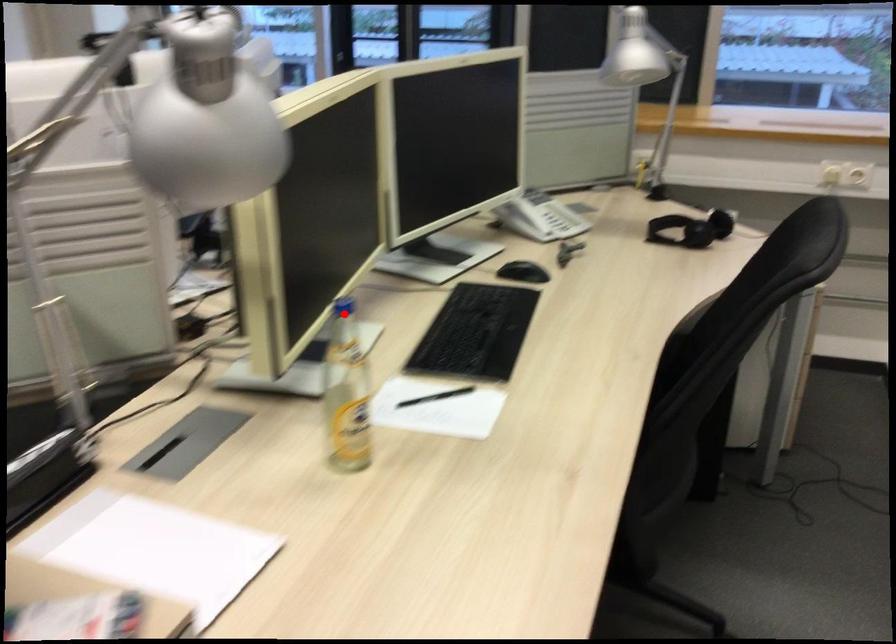
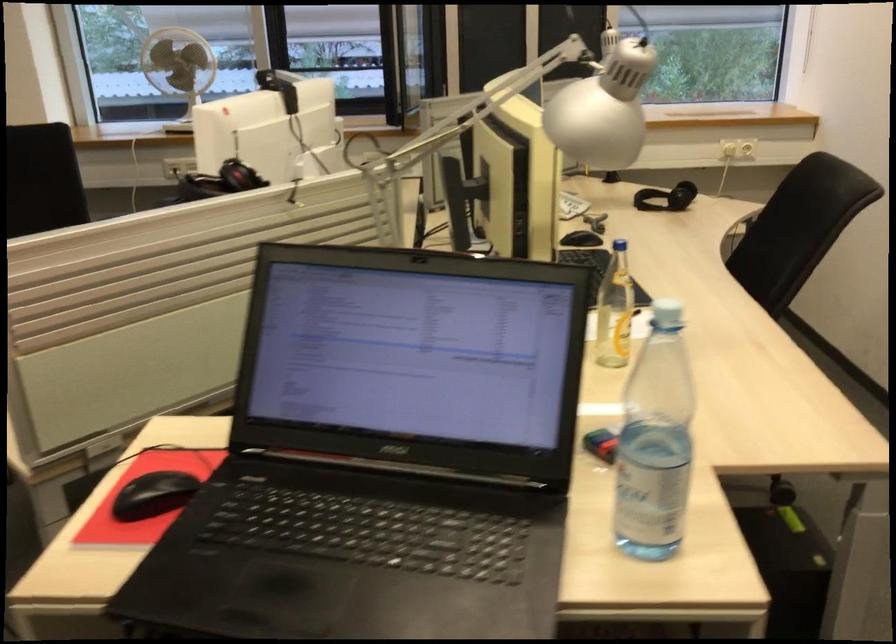
The point at the highlighted location is marked in the first image. Where is the corresponding point in the second image?

(618, 245)